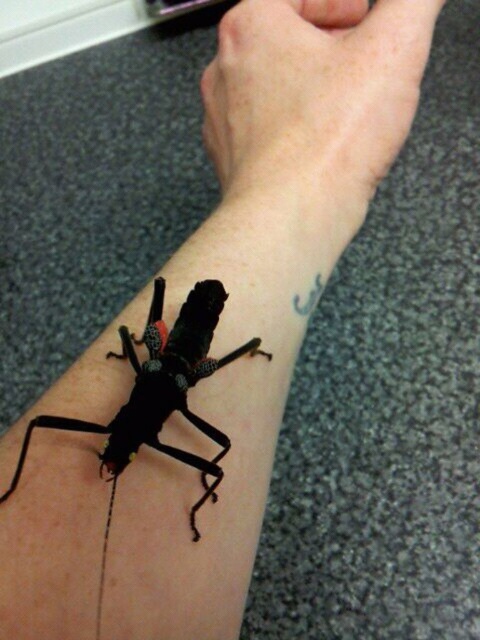
Is smooth skin at upper center to the left of black matte insect at lower left from the viewer's perspective?

Incorrect, smooth skin at upper center is not on the left side of black matte insect at lower left.

How far apart are smooth skin at upper center and black matte insect at lower left?

smooth skin at upper center and black matte insect at lower left are 18.54 centimeters apart from each other.

Is point (276, 13) closer to viewer compared to point (168, 392)?

No.

Locate an element on the screen. smooth skin at upper center is located at coordinates (313, 96).